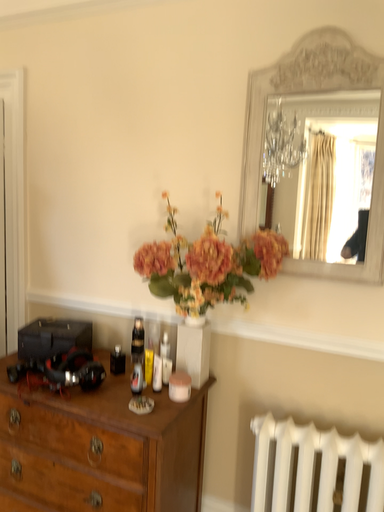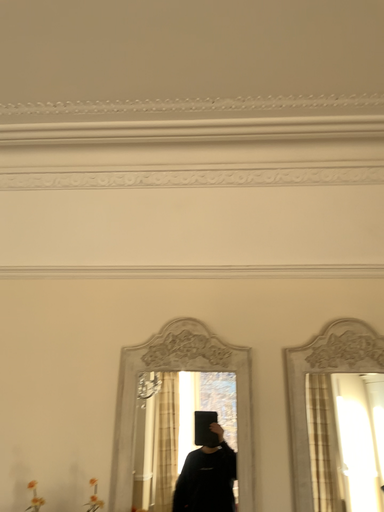
Question: How did the camera likely rotate when shooting the video?

Choices:
 (A) rotated right
 (B) rotated left

Answer: (A)